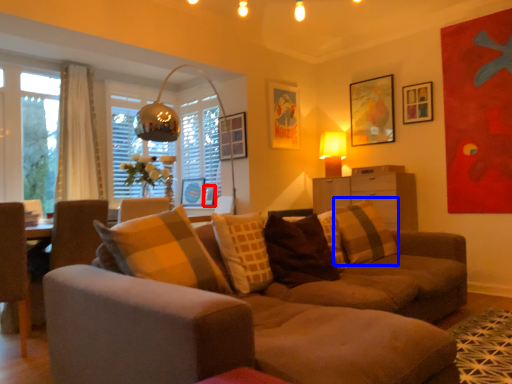
Question: Which object is further to the camera taking this photo, picture frame (highlighted by a red box) or pillow (highlighted by a blue box)?

Choices:
 (A) picture frame
 (B) pillow

Answer: (A)